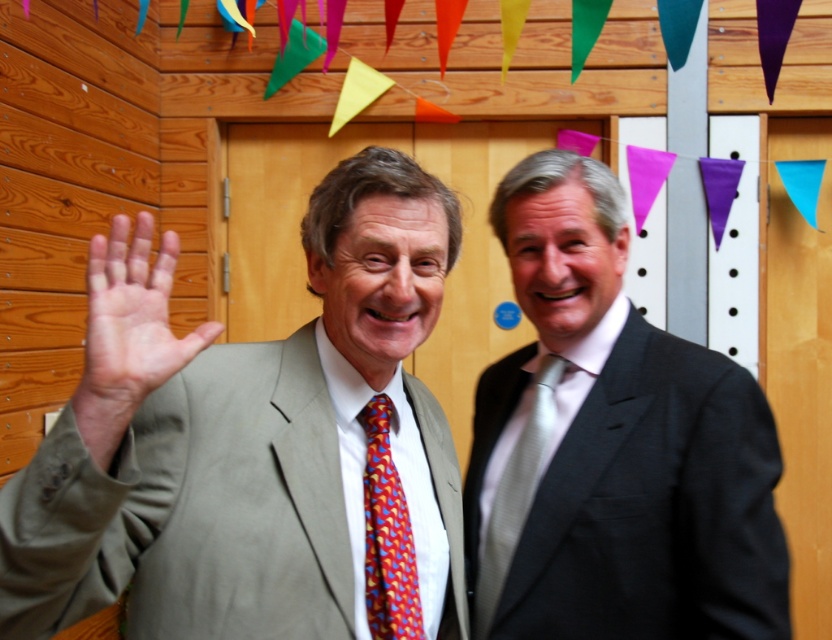
Who is lower down, light skin palm at center or silky silver tie at right?

Positioned lower is silky silver tie at right.

At what (x,y) coordinates should I click in order to perform the action: click on light skin palm at center. Please return your answer as a coordinate pair (x, y). Looking at the image, I should click on (130, 324).

Which is above, multicolored silk tie at center or silky silver tie at right?

Positioned higher is multicolored silk tie at center.

Who is more distant from viewer, (382, 605) or (526, 477)?

Positioned behind is point (526, 477).

What do you see at coordinates (387, 534) in the screenshot? I see `multicolored silk tie at center` at bounding box center [387, 534].

At what (x,y) coordinates should I click in order to perform the action: click on multicolored silk tie at center. Please return your answer as a coordinate pair (x, y). Looking at the image, I should click on (387, 534).

Where is `matte gray suit at left`? matte gray suit at left is located at coordinates (256, 452).

Does point (236, 388) come farther from viewer compared to point (380, 426)?

No, it is in front of (380, 426).

At what (x,y) coordinates should I click in order to perform the action: click on matte gray suit at left. Please return your answer as a coordinate pair (x, y). This screenshot has width=832, height=640. Looking at the image, I should click on (256, 452).